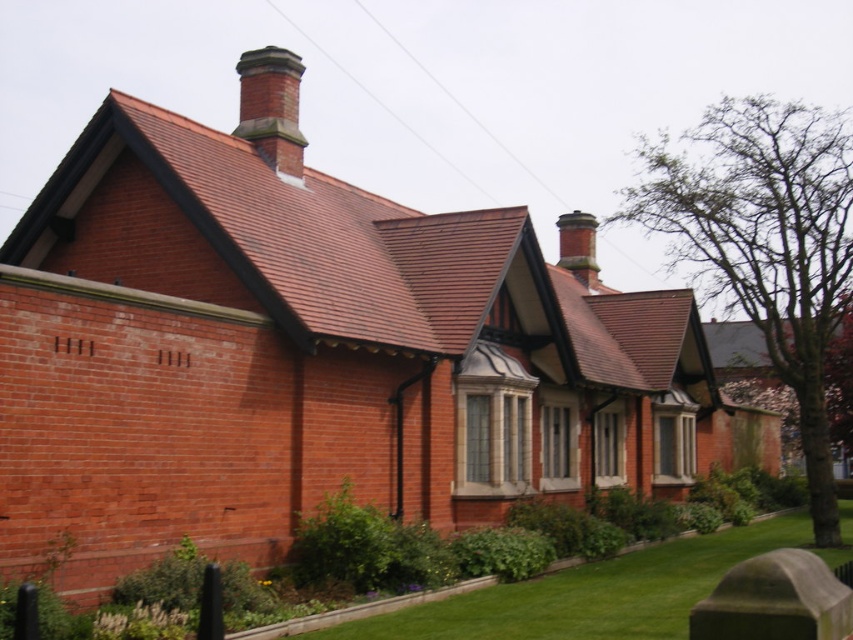
Question: Can you confirm if green grass at lower center is positioned above smooth brick chimney at upper center?

Choices:
 (A) no
 (B) yes

Answer: (A)

Question: Among these objects, which one is farthest from the camera?

Choices:
 (A) green grass at lower center
 (B) brick chimney at upper center
 (C) smooth brick chimney at upper center

Answer: (C)

Question: Which object is the farthest from the green grass at lower center?

Choices:
 (A) smooth brick chimney at upper center
 (B) brick chimney at upper center

Answer: (A)

Question: Which point is farther to the camera?

Choices:
 (A) (263, 80)
 (B) (573, 260)

Answer: (B)

Question: Is brick chimney at upper center positioned before smooth brick chimney at upper center?

Choices:
 (A) yes
 (B) no

Answer: (A)

Question: Does brick chimney at upper center appear on the right side of smooth brick chimney at upper center?

Choices:
 (A) yes
 (B) no

Answer: (B)